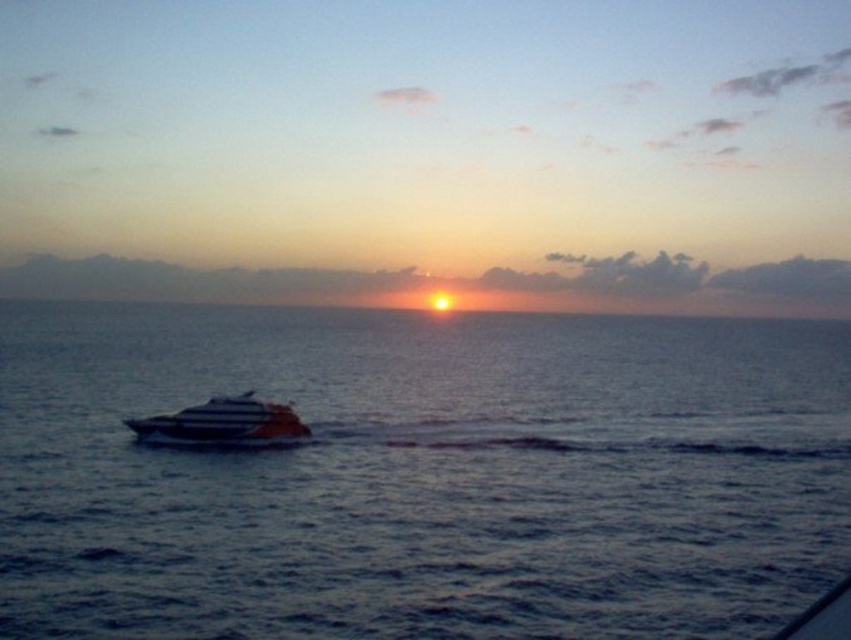
Does blue water at center have a smaller size compared to white glossy boat at center?

Actually, blue water at center might be larger than white glossy boat at center.

Can you confirm if blue water at center is bigger than white glossy boat at center?

Correct, blue water at center is larger in size than white glossy boat at center.

What do you see at coordinates (421, 476) in the screenshot? I see `blue water at center` at bounding box center [421, 476].

At what (x,y) coordinates should I click in order to perform the action: click on blue water at center. Please return your answer as a coordinate pair (x, y). The width and height of the screenshot is (851, 640). Looking at the image, I should click on (421, 476).